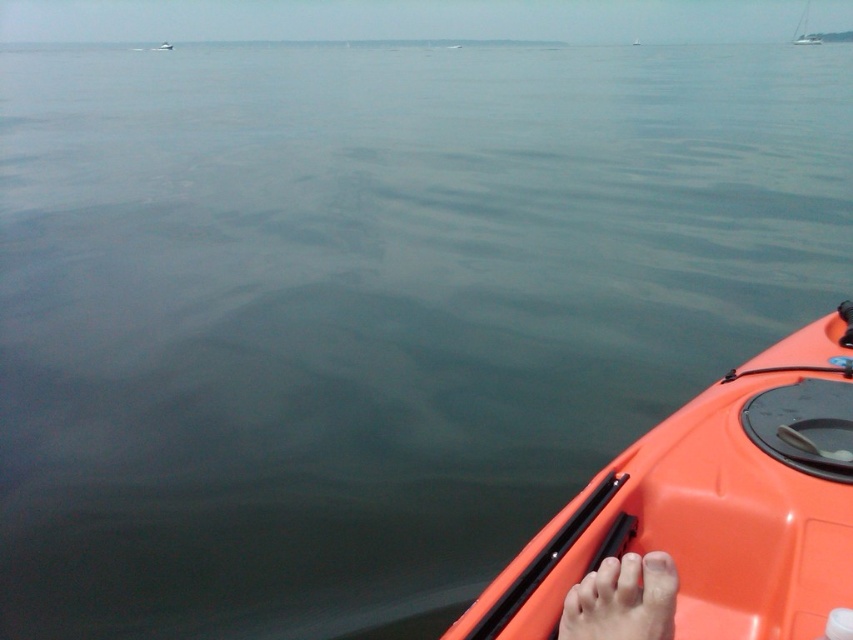
Question: From the image, what is the correct spatial relationship of skinny barefoot at lower right in relation to white sailboat at upper right?

Choices:
 (A) right
 (B) left

Answer: (B)

Question: Which of the following is the closest to the observer?

Choices:
 (A) skinny barefoot at lower right
 (B) orange plastic kayak at lower right

Answer: (A)

Question: Considering the real-world distances, which object is closest to the white sailboat at upper right?

Choices:
 (A) orange plastic kayak at lower right
 (B) skinny barefoot at lower right

Answer: (A)

Question: Is skinny barefoot at lower right smaller than white sailboat at upper right?

Choices:
 (A) yes
 (B) no

Answer: (A)

Question: Considering the real-world distances, which object is closest to the white sailboat at upper right?

Choices:
 (A) orange plastic kayak at lower right
 (B) skinny barefoot at lower right

Answer: (A)

Question: Can you confirm if orange plastic kayak at lower right is wider than skinny barefoot at lower right?

Choices:
 (A) no
 (B) yes

Answer: (B)